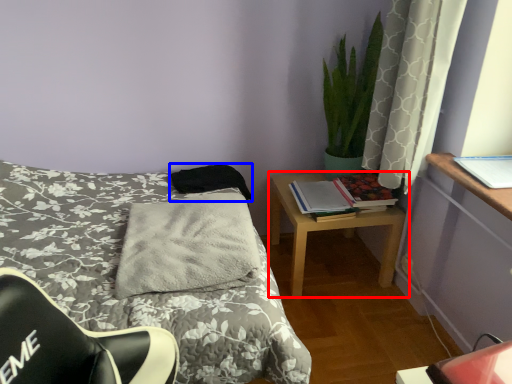
Question: Among these objects, which one is nearest to the camera, nightstand (highlighted by a red box) or pillow (highlighted by a blue box)?

Choices:
 (A) nightstand
 (B) pillow

Answer: (A)